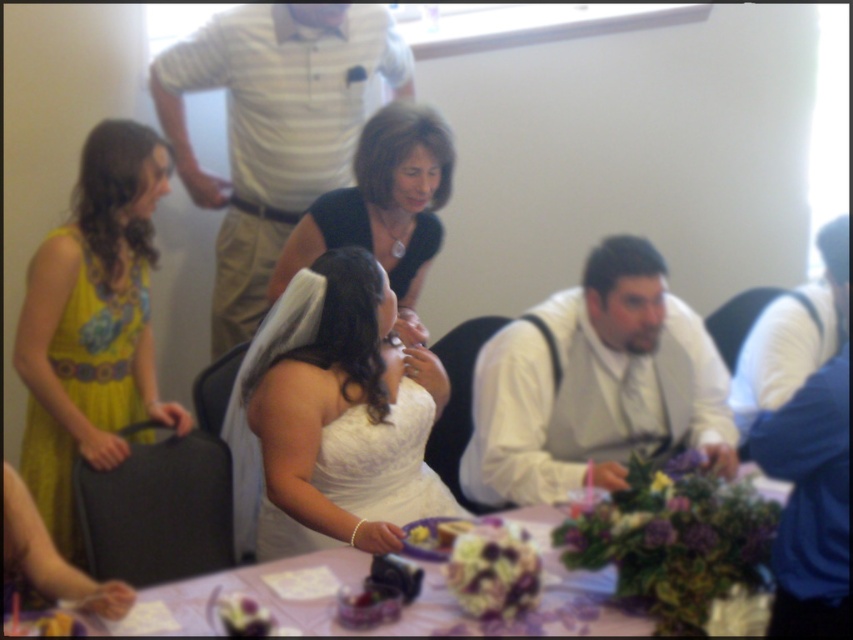
Can you confirm if white lace tablecloth at center is smaller than blue satin vest at right?

Correct, white lace tablecloth at center occupies less space than blue satin vest at right.

Can you confirm if white lace tablecloth at center is positioned to the right of blue satin vest at right?

No, white lace tablecloth at center is not to the right of blue satin vest at right.

Is point (198, 577) closer to viewer compared to point (790, 355)?

Yes, it is.

Where is `white lace tablecloth at center`? This screenshot has width=853, height=640. white lace tablecloth at center is located at coordinates (363, 579).

Does white satin vest at center appear on the right side of blue satin vest at right?

No, white satin vest at center is not to the right of blue satin vest at right.

Is white satin vest at center below blue satin vest at right?

Indeed, white satin vest at center is positioned under blue satin vest at right.

Measure the distance between white satin vest at center and camera.

white satin vest at center and camera are 1.93 meters apart from each other.

Locate an element on the screen. The width and height of the screenshot is (853, 640). white satin vest at center is located at coordinates (595, 385).

Does black matte dress at upper center have a larger size compared to white satin dress at center?

Correct, black matte dress at upper center is larger in size than white satin dress at center.

From the picture: Who is more distant from viewer, (410, 273) or (338, 420)?

The point (410, 273) is more distant.

This screenshot has width=853, height=640. I want to click on black matte dress at upper center, so click(x=381, y=204).

The image size is (853, 640). Find the location of `black matte dress at upper center`. black matte dress at upper center is located at coordinates 381,204.